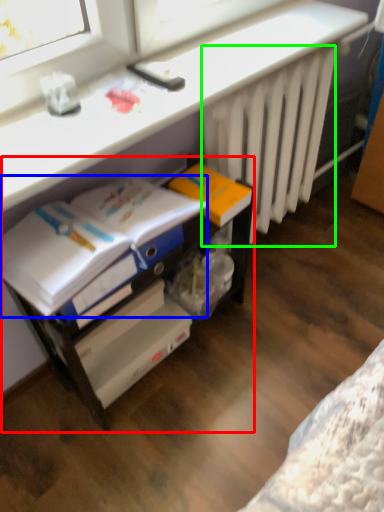
Question: Based on their relative distances, which object is farther from file cabinet (highlighted by a red box)? Choose from magazine (highlighted by a blue box) and radiator (highlighted by a green box).

Choices:
 (A) magazine
 (B) radiator

Answer: (B)